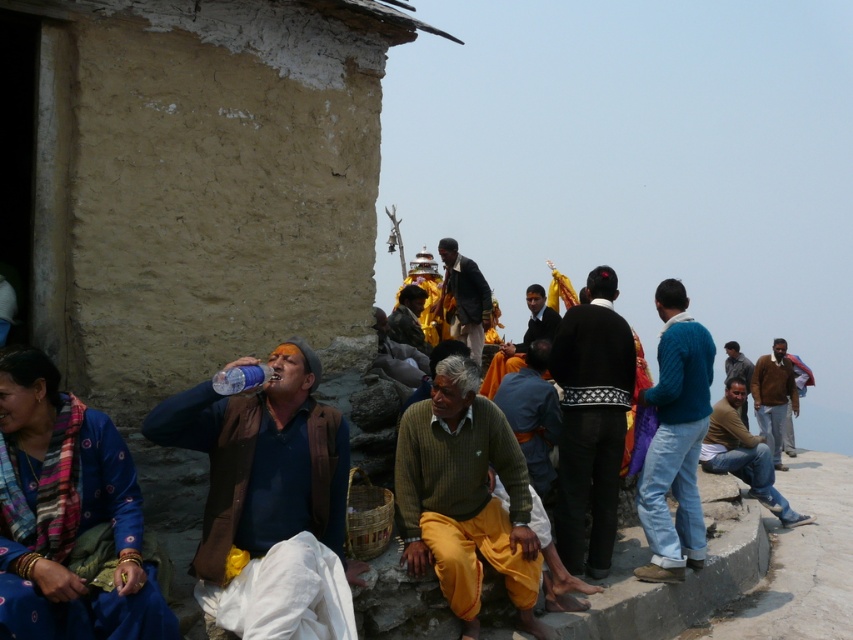
Question: Does brown woolen sweater at right appear on the right side of transparent plastic bottle at center?

Choices:
 (A) yes
 (B) no

Answer: (A)

Question: Which object appears closest to the camera in this image?

Choices:
 (A) blue knitted sweater at right
 (B) orange fabric cloth at center
 (C) dark brown leather jacket at center

Answer: (A)

Question: Which point is farther to the camera?

Choices:
 (A) dark brown leather jacket at center
 (B) brown leather jacket at lower right
 (C) transparent plastic bottle at center
 (D) knitted green sweater at center

Answer: (B)

Question: Does knitted green sweater at center come in front of brown woolen sweater at right?

Choices:
 (A) yes
 (B) no

Answer: (A)

Question: Which object appears closest to the camera in this image?

Choices:
 (A) blue knitted sweater at right
 (B) black wool sweater at center

Answer: (B)

Question: Is blue fabric shirt at center positioned behind brown woolen sweater at right?

Choices:
 (A) yes
 (B) no

Answer: (B)